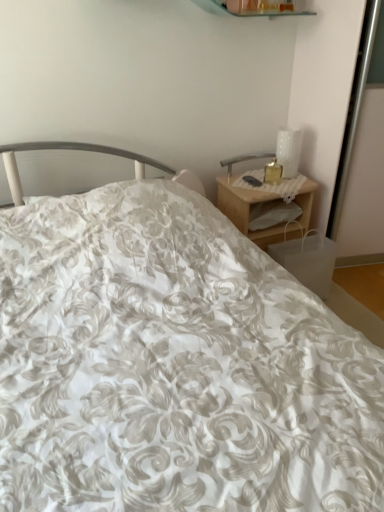
Question: Is white glossy table lamp at upper right at the left side of woodennightstand at right?

Choices:
 (A) yes
 (B) no

Answer: (B)

Question: Is white glossy table lamp at upper right with woodennightstand at right?

Choices:
 (A) no
 (B) yes

Answer: (A)

Question: Can you confirm if white glossy table lamp at upper right is wider than woodennightstand at right?

Choices:
 (A) no
 (B) yes

Answer: (A)

Question: Is white glossy table lamp at upper right thinner than woodennightstand at right?

Choices:
 (A) no
 (B) yes

Answer: (B)

Question: From a real-world perspective, is white glossy table lamp at upper right below woodennightstand at right?

Choices:
 (A) yes
 (B) no

Answer: (B)

Question: Is white glossy table lamp at upper right facing away from woodennightstand at right?

Choices:
 (A) no
 (B) yes

Answer: (A)

Question: Is translucent glass candle at upper right taller than white glossy table lamp at upper right?

Choices:
 (A) no
 (B) yes

Answer: (A)

Question: Is translucent glass candle at upper right positioned in front of white glossy table lamp at upper right?

Choices:
 (A) yes
 (B) no

Answer: (A)

Question: Is translucent glass candle at upper right bigger than white glossy table lamp at upper right?

Choices:
 (A) no
 (B) yes

Answer: (A)

Question: Considering the relative sizes of translucent glass candle at upper right and white glossy table lamp at upper right in the image provided, is translucent glass candle at upper right shorter than white glossy table lamp at upper right?

Choices:
 (A) yes
 (B) no

Answer: (A)

Question: Are translucent glass candle at upper right and white glossy table lamp at upper right located far from each other?

Choices:
 (A) no
 (B) yes

Answer: (A)

Question: Can you see translucent glass candle at upper right touching white glossy table lamp at upper right?

Choices:
 (A) yes
 (B) no

Answer: (A)

Question: Is translucent glass candle at upper right inside white glossy table lamp at upper right?

Choices:
 (A) no
 (B) yes

Answer: (A)